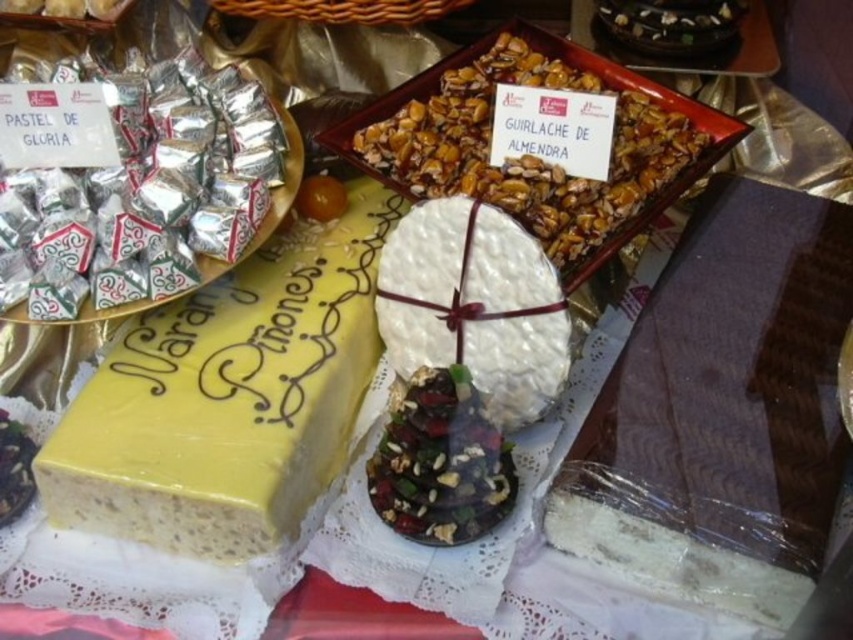
Question: Does yellow sponge cake at center appear over chocolate-covered nuts at center?

Choices:
 (A) no
 (B) yes

Answer: (B)

Question: Which of these objects is positioned farthest from the yellow sponge cake at center?

Choices:
 (A) white textured cake at center
 (B) chocolate-covered nuts at center
 (C) shiny almond brittle at center

Answer: (C)

Question: Can you confirm if yellow sponge cake at center is bigger than chocolate-covered nuts at center?

Choices:
 (A) no
 (B) yes

Answer: (B)

Question: Among these objects, which one is nearest to the camera?

Choices:
 (A) white textured cake at center
 (B) shiny almond brittle at center
 (C) chocolate-covered nuts at center

Answer: (C)

Question: Which object appears farthest from the camera in this image?

Choices:
 (A) white textured cake at center
 (B) chocolate-covered nuts at center

Answer: (A)

Question: Is shiny almond brittle at center wider than chocolate-covered nuts at center?

Choices:
 (A) yes
 (B) no

Answer: (A)